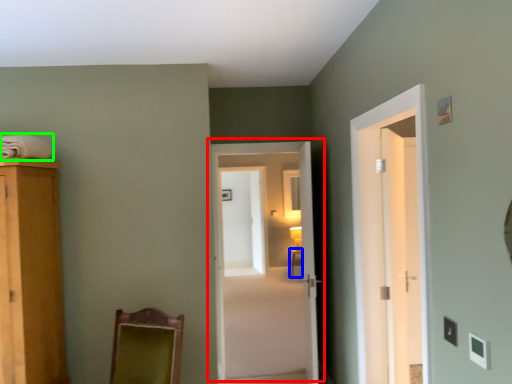
Question: Which is nearer to the door (highlighted by a red box)? table (highlighted by a blue box) or laundry (highlighted by a green box).

Choices:
 (A) table
 (B) laundry

Answer: (B)